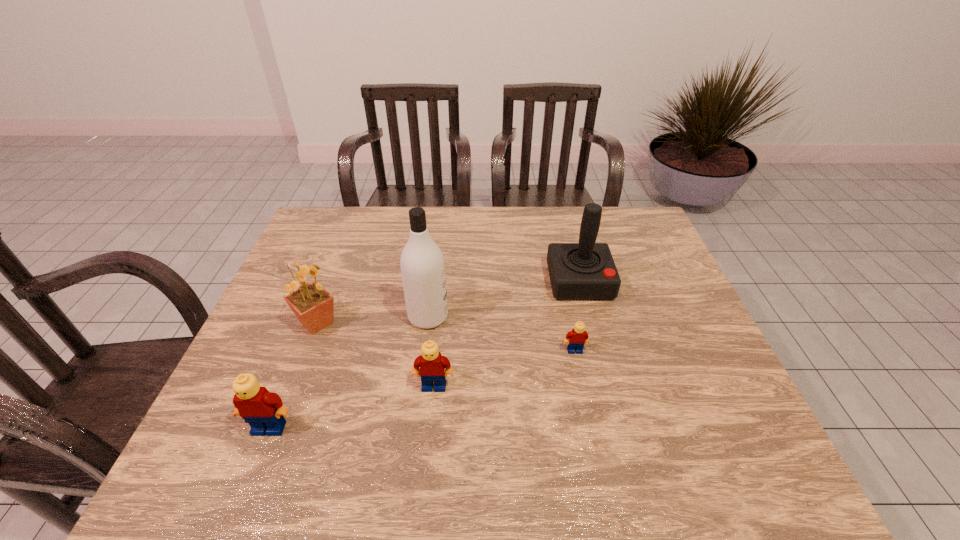
Locate an element on the screen. The image size is (960, 540). free point located 0.060m on the front-facing side of the rightmost Lego is located at coordinates (580, 374).

Where is `free region located on the front-facing side of the tallest object`? free region located on the front-facing side of the tallest object is located at coordinates (533, 316).

Find the location of `free space located on the base of the joystick`. free space located on the base of the joystick is located at coordinates (589, 321).

You are a GUI agent. You are given a task and a screenshot of the screen. Output one action in this format:
    pyautogui.click(x=<x>, y=<y>)
    Task: Click on the blank space located 0.160m at the front of the sunflower with flowers visible
    This screenshot has width=960, height=540.
    Given the screenshot: What is the action you would take?
    pyautogui.click(x=401, y=323)

This screenshot has height=540, width=960. In order to click on object located at the near edge in this screenshot , I will do `click(264, 411)`.

Locate an element on the screen. This screenshot has width=960, height=540. Lego located at the left edge is located at coordinates (264, 411).

What are the coordinates of `sunflower positioned at the left edge` in the screenshot? It's located at (x=313, y=306).

The width and height of the screenshot is (960, 540). What are the coordinates of `object that is positioned at the near left corner` in the screenshot? It's located at (264, 411).

Locate an element on the screen. The image size is (960, 540). vacant space at the far edge is located at coordinates (555, 224).

Image resolution: width=960 pixels, height=540 pixels. What are the coordinates of `vacant space at the near edge of the desktop` in the screenshot? It's located at (559, 423).